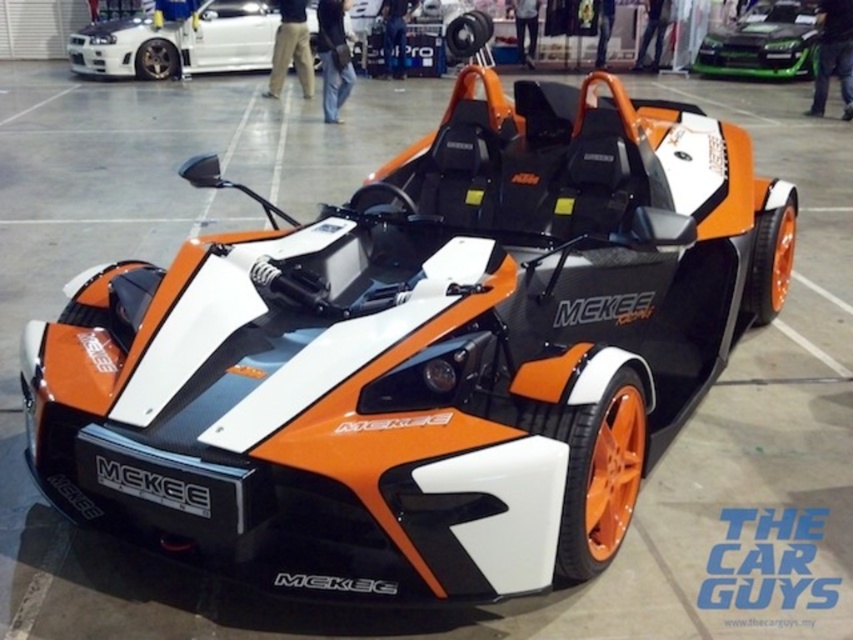
You are at a car exhibition and want to take a photo of the white glossy sedan at upper left and the green glossy car at upper center. From your current position, which car is positioned lower in the frame?

The white glossy sedan at upper left is located below the green glossy car at upper center, so it is positioned lower in the frame.